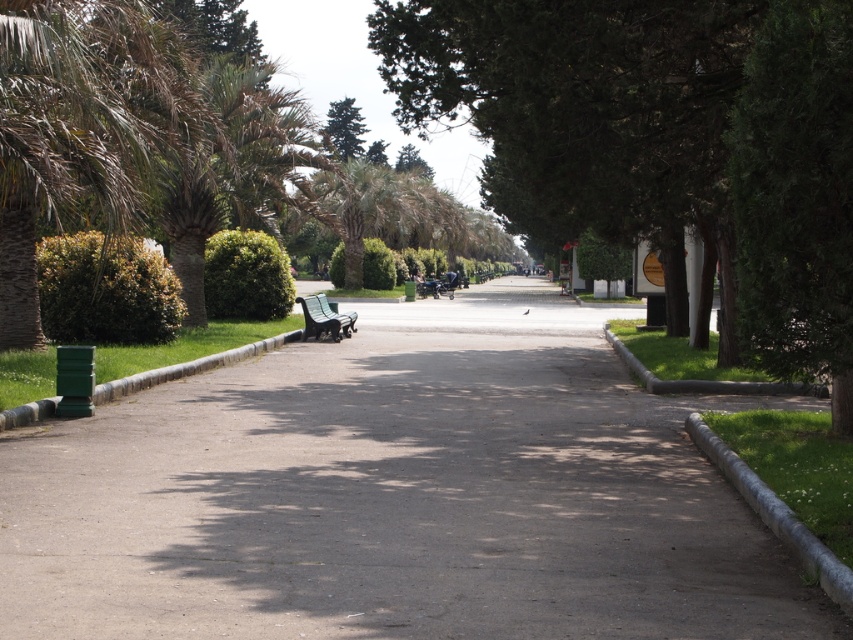
Question: Does gray asphalt pavement at center have a greater width compared to green leafy tree at center?

Choices:
 (A) yes
 (B) no

Answer: (A)

Question: Is gray asphalt pavement at center thinner than green leafy tree at center?

Choices:
 (A) no
 (B) yes

Answer: (A)

Question: Which point is closer to the camera taking this photo?

Choices:
 (A) (416, 93)
 (B) (811, 602)
 (C) (320, 305)

Answer: (B)

Question: Estimate the real-world distances between objects in this image. Which object is farther from the green leafy tree at center?

Choices:
 (A) gray asphalt pavement at center
 (B) green plastic bench at center

Answer: (B)

Question: Does gray asphalt pavement at center have a larger size compared to green leafy tree at center?

Choices:
 (A) no
 (B) yes

Answer: (A)

Question: Among these objects, which one is farthest from the camera?

Choices:
 (A) gray asphalt pavement at center
 (B) green plastic bench at center

Answer: (B)